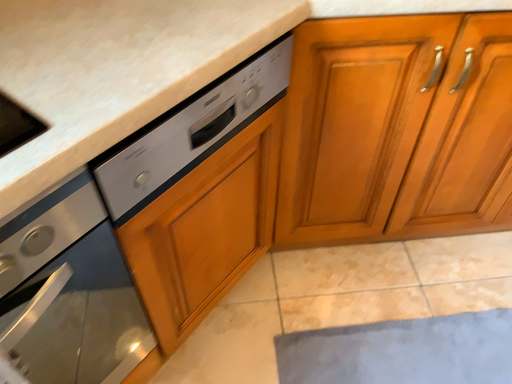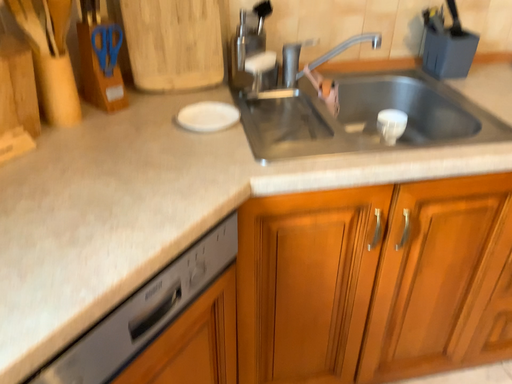
Question: How did the camera likely rotate when shooting the video?

Choices:
 (A) rotated downward
 (B) rotated upward

Answer: (B)